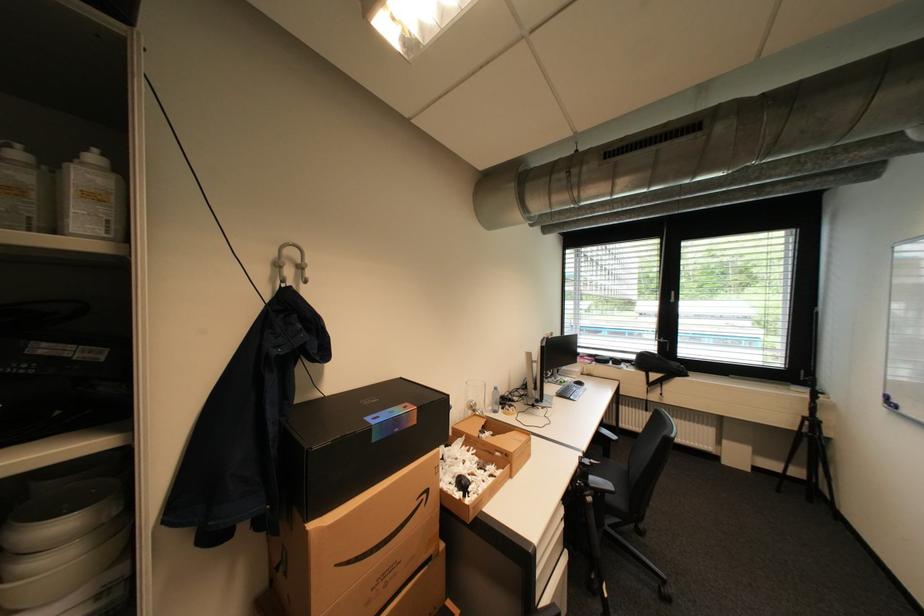
Describe the element at coordinates (91, 198) in the screenshot. The height and width of the screenshot is (616, 924). I see `the white container` at that location.